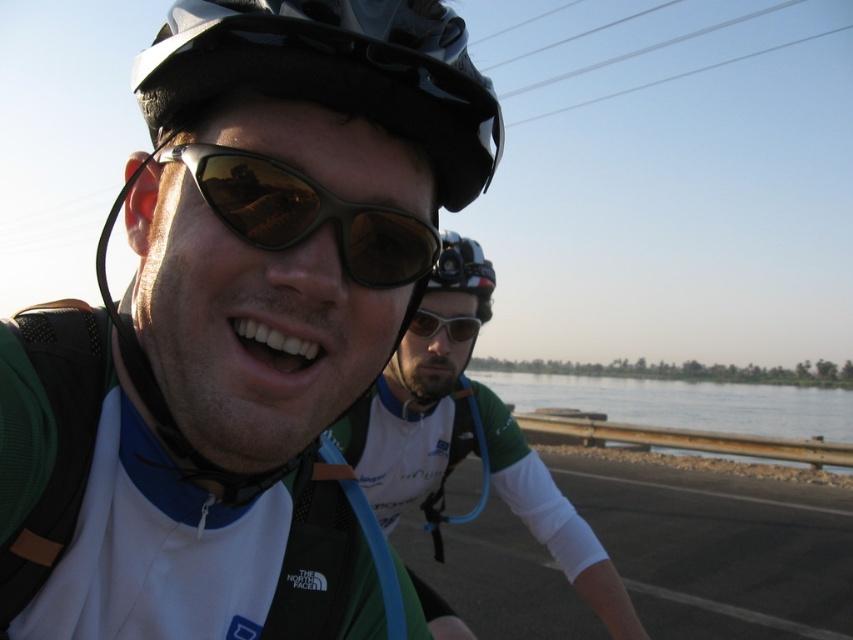
You are a photographer standing at the point marked by the coordinates point [236,324]. You want to take a photo of the cyclist in the foreground wearing the white and green cycling jersey with The North Face logo. Will the matte black helmet at center be in the way of your shot?

The point [236,324] marks the matte black helmet at center, so standing at that point would position you directly at the helmet, making it impossible to take a clear photo of the cyclist in the foreground without the helmet obstructing the view.

You are a cyclist preparing for a race and need to choose between the shiny brown plastic goggles at center and the matte black goggles at center. Based on the description, which pair might be more suitable for a long ride in sunny conditions?

The shiny brown plastic goggles at center is larger in size than matte black goggles at center, so it might provide better coverage and protection from the sun, making it more suitable for a long ride in sunny conditions.

You are a photographer trying to capture a closeup shot of both the matte black helmet at center and the shiny brown plastic goggles at center. Since you want to ensure both are clearly visible, which object should you focus on first to account for their size differences?

The matte black helmet at center is bigger than the shiny brown plastic goggles at center, so you should focus on the matte black helmet at center first to ensure its details are sharp before adjusting for the smaller goggles.